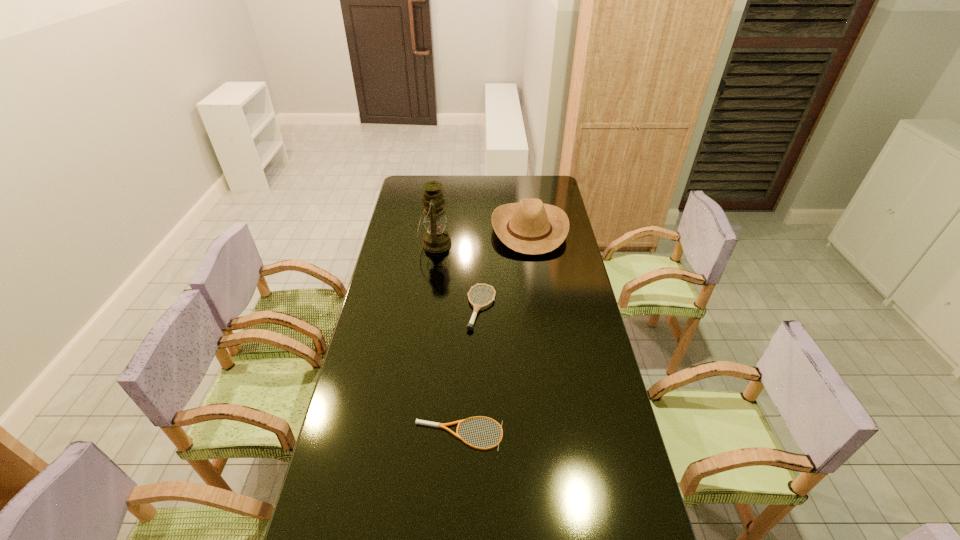
Where is `vacant space located on the back of the second nearest object`? The height and width of the screenshot is (540, 960). vacant space located on the back of the second nearest object is located at coordinates (482, 274).

Identify the location of vacant space located 0.260m on the back of the shorter tennis racket. (462, 352).

This screenshot has width=960, height=540. Find the location of `object that is at the left edge`. object that is at the left edge is located at coordinates click(436, 239).

Locate an element on the screen. The width and height of the screenshot is (960, 540). object located at the right edge is located at coordinates (531, 227).

Find the location of `free space at the left edge of the desktop`. free space at the left edge of the desktop is located at coordinates (399, 249).

This screenshot has width=960, height=540. I want to click on vacant space at the right edge of the desktop, so click(x=559, y=266).

What are the coordinates of `vacant area at the far right corner of the desktop` in the screenshot? It's located at (559, 187).

Where is `empty space between the second tallest object and the farther tennis racket`? The width and height of the screenshot is (960, 540). empty space between the second tallest object and the farther tennis racket is located at coordinates (506, 269).

Find the location of `empty location between the shortest object and the farther tennis racket`. empty location between the shortest object and the farther tennis racket is located at coordinates (470, 371).

Where is `vacant space that is in between the taller tennis racket and the nearest object`? The width and height of the screenshot is (960, 540). vacant space that is in between the taller tennis racket and the nearest object is located at coordinates (470, 371).